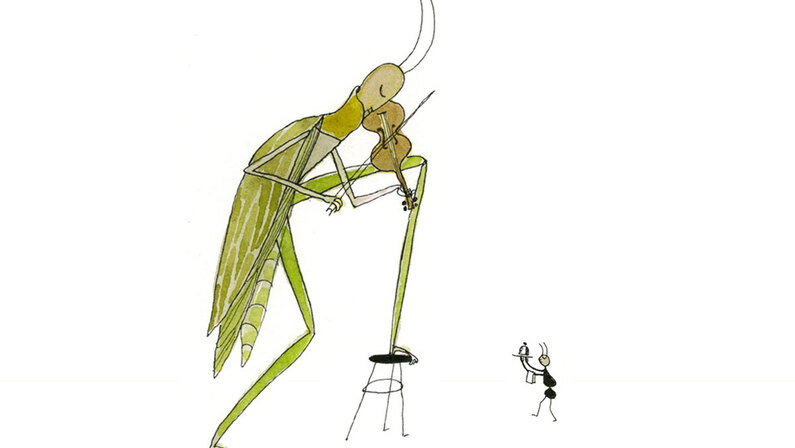
I want to click on food platter, so click(524, 348).